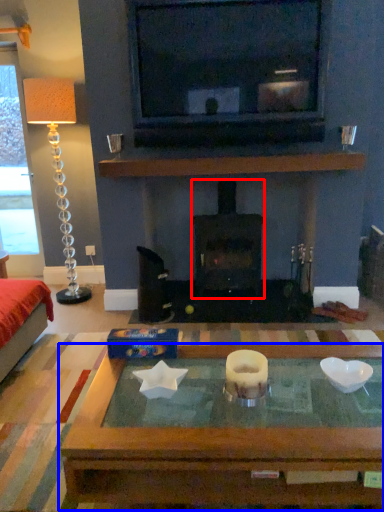
Question: Which object is further to the camera taking this photo, wood burning stove (highlighted by a red box) or coffee table (highlighted by a blue box)?

Choices:
 (A) wood burning stove
 (B) coffee table

Answer: (A)